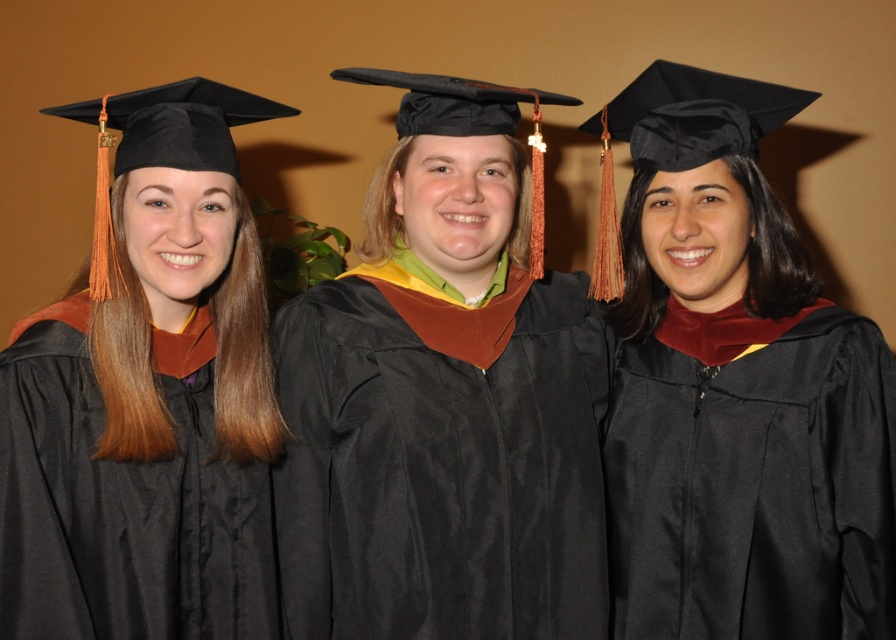
Question: Which point is farther from the camera taking this photo?

Choices:
 (A) (757, 224)
 (B) (437, 227)

Answer: (A)

Question: Can you confirm if black matte graduation gown at center is bigger than matte black graduation gown at left?

Choices:
 (A) yes
 (B) no

Answer: (A)

Question: Can you confirm if satin black graduation gown at center is positioned to the left of black matte graduation gown at center?

Choices:
 (A) no
 (B) yes

Answer: (B)

Question: Considering the real-world distances, which object is farthest from the matte black graduation gown at left?

Choices:
 (A) black matte graduation gown at center
 (B) satin black graduation gown at center

Answer: (A)

Question: Which object appears closest to the camera in this image?

Choices:
 (A) satin black graduation gown at center
 (B) black matte graduation gown at center

Answer: (A)

Question: Is satin black graduation gown at center further to the viewer compared to matte black graduation gown at left?

Choices:
 (A) no
 (B) yes

Answer: (B)